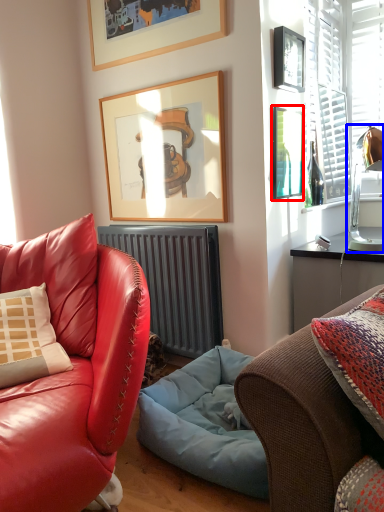
Question: Which object appears farthest to the camera in this image, picture frame (highlighted by a red box) or lamp (highlighted by a blue box)?

Choices:
 (A) picture frame
 (B) lamp

Answer: (A)